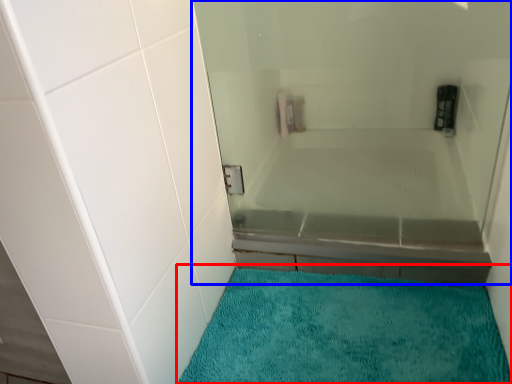
Question: Which of the following is the closest to the observer, bath mat (highlighted by a red box) or bath (highlighted by a blue box)?

Choices:
 (A) bath mat
 (B) bath

Answer: (A)